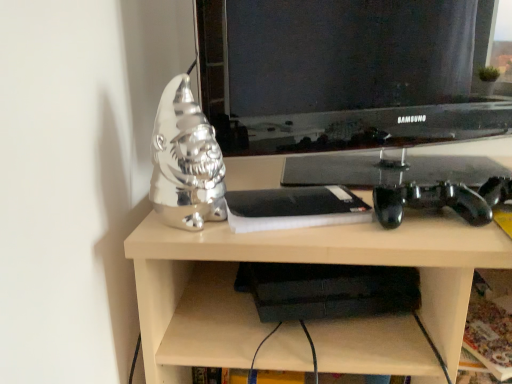
Locate an element on the screen. free spot above metallic silver gnome at left (from a real-world perspective) is located at coordinates (366, 188).